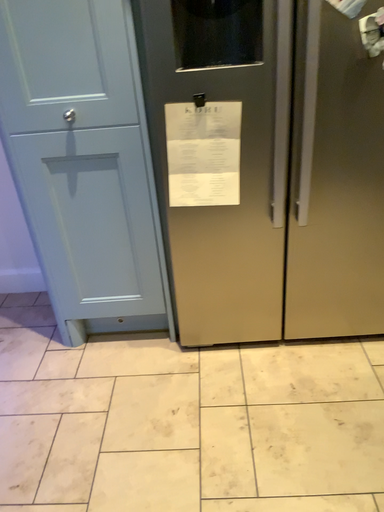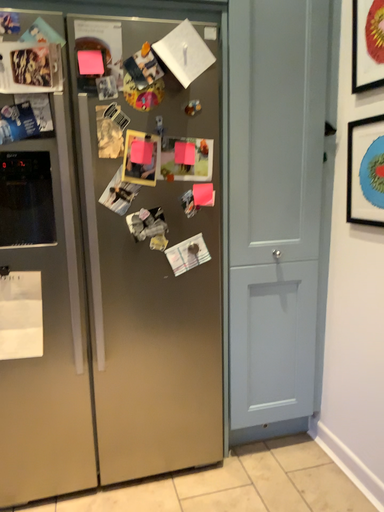
Question: How did the camera likely rotate when shooting the video?

Choices:
 (A) rotated left
 (B) rotated right

Answer: (B)